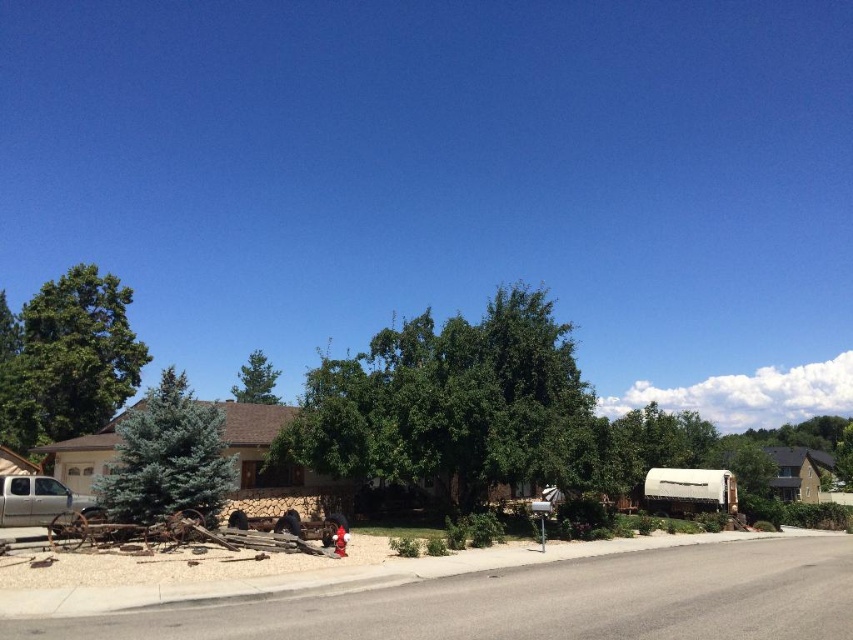
Question: Can you confirm if green leafy tree at center is positioned to the right of blue-green coniferous tree at left?

Choices:
 (A) no
 (B) yes

Answer: (B)

Question: Which object is closer to the camera taking this photo?

Choices:
 (A) green leafy tree at center
 (B) green leafy tree at upper center

Answer: (A)

Question: Is blue-green coniferous tree at left closer to camera compared to silver metallic truck at lower left?

Choices:
 (A) no
 (B) yes

Answer: (B)

Question: Which of these objects is positioned farthest from the blue-green coniferous tree at left?

Choices:
 (A) silver metallic truck at lower left
 (B) green leafy tree at left

Answer: (B)

Question: Can you confirm if silver metallic truck at lower left is positioned below green leafy tree at upper center?

Choices:
 (A) yes
 (B) no

Answer: (B)

Question: Which point is closer to the camera taking this photo?

Choices:
 (A) (13, 486)
 (B) (109, 484)

Answer: (B)